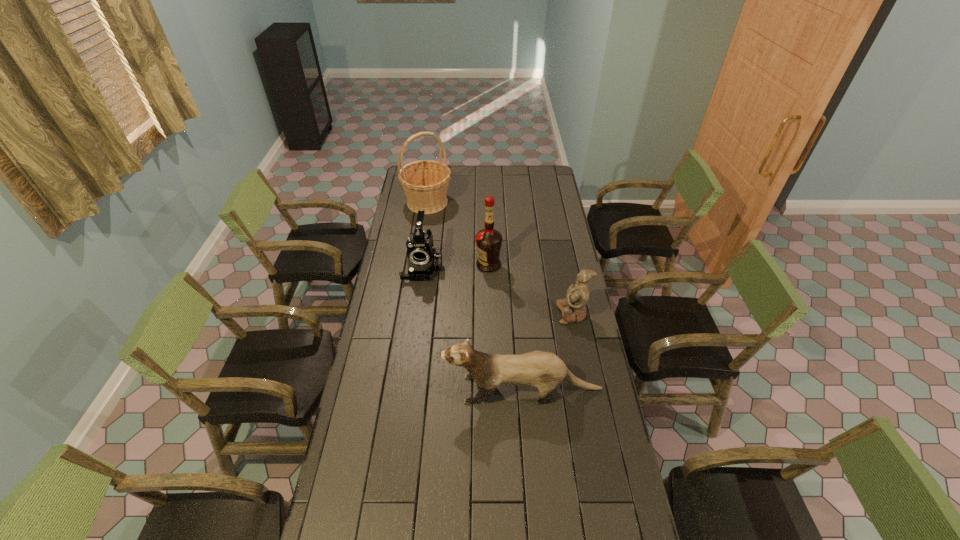
At what (x,y) coordinates should I click in order to perform the action: click on basket. Please return your answer as a coordinate pair (x, y). Image resolution: width=960 pixels, height=540 pixels. Looking at the image, I should click on (425, 182).

Identify the location of liquor. (488, 241).

I want to click on ferret, so click(x=544, y=370).

Identify the location of camcorder. (423, 260).

Identify the location of figurine. (573, 309).

Where is `free space located 0.060m on the right of the basket`? free space located 0.060m on the right of the basket is located at coordinates (463, 202).

Find the location of a particular element. free space located 0.240m on the front and back of the liquor is located at coordinates (426, 265).

Where is `blank area located 0.210m on the front and back of the liquor`? The height and width of the screenshot is (540, 960). blank area located 0.210m on the front and back of the liquor is located at coordinates (432, 265).

Find the location of `free region located 0.090m on the front and back of the liquor`. free region located 0.090m on the front and back of the liquor is located at coordinates (457, 265).

Where is `free space located on the face of the nearest object`? Image resolution: width=960 pixels, height=540 pixels. free space located on the face of the nearest object is located at coordinates (427, 389).